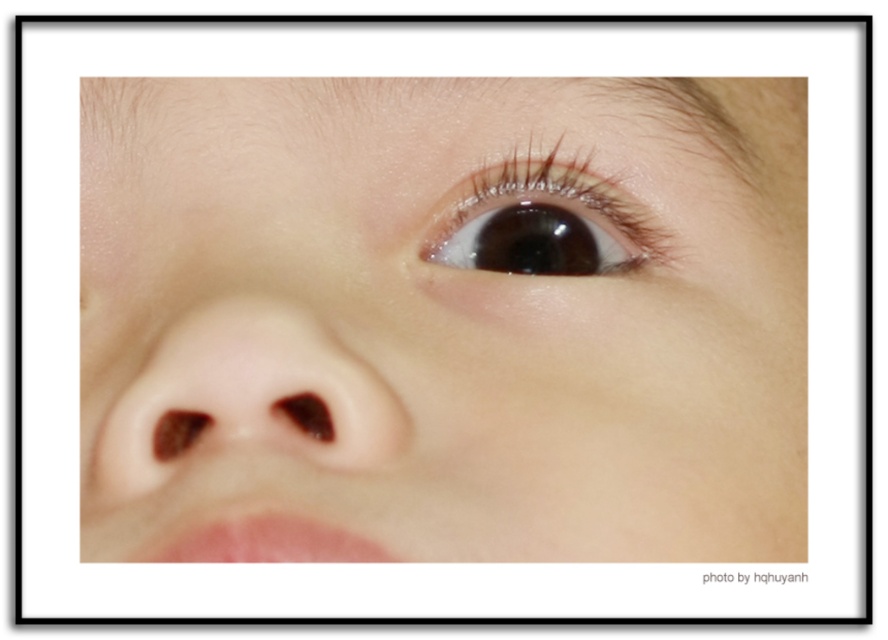
Is smooth skin eye at upper center in front of glossy brown eye at upper center?

Yes, smooth skin eye at upper center is closer to the viewer.

Is point (189, 506) in front of point (464, 268)?

Yes, point (189, 506) is in front of point (464, 268).

Where is `smooth skin eye at upper center`? The height and width of the screenshot is (640, 888). smooth skin eye at upper center is located at coordinates (440, 321).

Which is above, smooth flesh-colored nose at center or glossy brown eye at upper center?

glossy brown eye at upper center is above.

Does smooth flesh-colored nose at center come behind glossy brown eye at upper center?

No, smooth flesh-colored nose at center is closer to the viewer.

The width and height of the screenshot is (888, 640). In order to click on smooth flesh-colored nose at center in this screenshot , I will do `click(244, 400)`.

Does smooth skin eye at upper center have a larger size compared to smooth flesh-colored nose at center?

Yes, smooth skin eye at upper center is bigger than smooth flesh-colored nose at center.

From the picture: Is smooth skin eye at upper center thinner than smooth flesh-colored nose at center?

No.

What are the coordinates of `smooth skin eye at upper center` in the screenshot? It's located at (440, 321).

This screenshot has height=640, width=888. Identify the location of smooth skin eye at upper center. (440, 321).